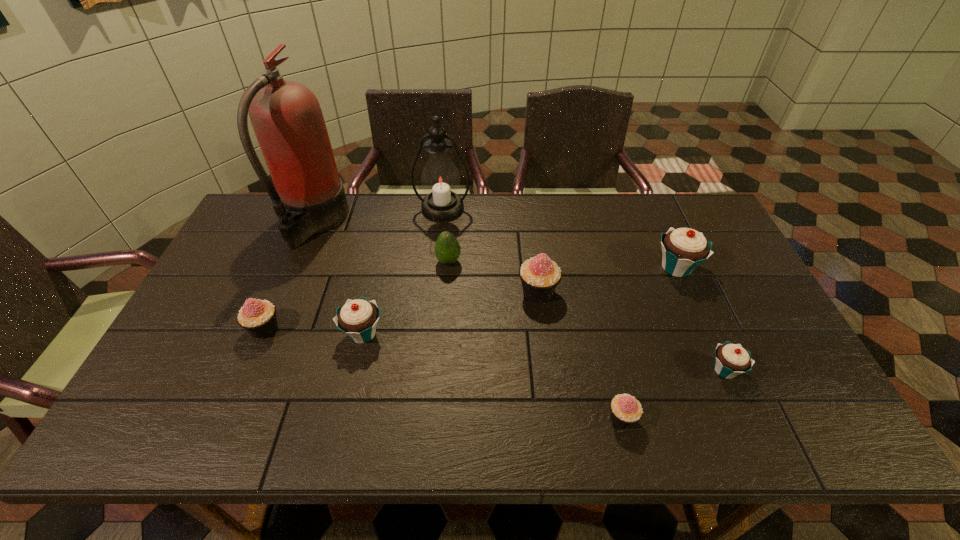
Locate an element on the screen. The height and width of the screenshot is (540, 960). green avocado is located at coordinates (447, 249).

I want to click on the smallest teal cupcake, so [x=731, y=360].

I want to click on the nearest teal cupcake, so click(731, 360).

You are a GUI agent. You are given a task and a screenshot of the screen. Output one action in this format:
    pyautogui.click(x=<x>, y=<y>)
    Task: Click on the fourth cupcake from left to right
    The width and height of the screenshot is (960, 540).
    Given the screenshot: What is the action you would take?
    pyautogui.click(x=626, y=410)

You are a GUI agent. You are given a task and a screenshot of the screen. Output one action in this format:
    pyautogui.click(x=<x>, y=<y>)
    Task: Click on the nearest object
    The width and height of the screenshot is (960, 540).
    Given the screenshot: What is the action you would take?
    pyautogui.click(x=626, y=410)

Identify the location of free spot located at the nozzle of the tallest object. (393, 222).

Identify the location of free space located on the front of the eighth shortest object. click(434, 296).

Image resolution: width=960 pixels, height=540 pixels. Find the location of `vacant space located 0.200m on the right of the farthest pink cupcake`. vacant space located 0.200m on the right of the farthest pink cupcake is located at coordinates (628, 292).

You are a GUI agent. You are given a task and a screenshot of the screen. Output one action in this format:
    pyautogui.click(x=<x>, y=<y>)
    Task: Click on the free space located on the left of the biggest teal cupcake
    Image resolution: width=960 pixels, height=540 pixels.
    Given the screenshot: What is the action you would take?
    pyautogui.click(x=553, y=268)

Where is `free space located 0.100m on the back of the leftmost pink cupcake`? free space located 0.100m on the back of the leftmost pink cupcake is located at coordinates (282, 288).